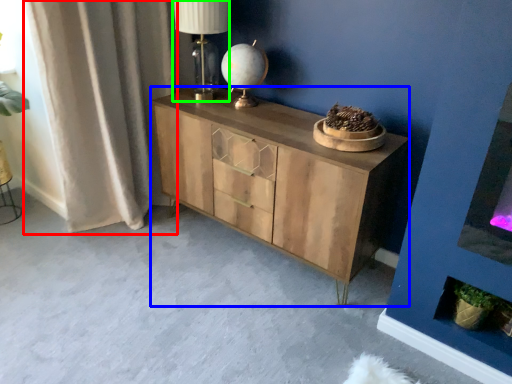
Question: Which object is the farthest from curtain (highlighted by a red box)? Choose among these: chest of drawers (highlighted by a blue box) or table lamp (highlighted by a green box).

Choices:
 (A) chest of drawers
 (B) table lamp

Answer: (A)